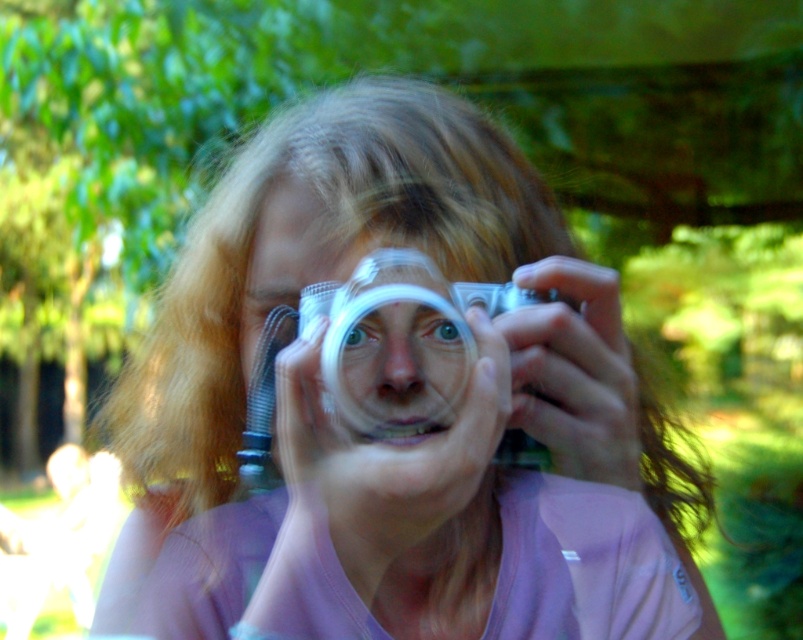
Question: Is the position of matte silver camera at center more distant than that of blue glossy eye at center?

Choices:
 (A) no
 (B) yes

Answer: (A)

Question: Is matte silver camera at center to the left of matte plastic face at center from the viewer's perspective?

Choices:
 (A) yes
 (B) no

Answer: (A)

Question: Where is matte plastic face at center located in relation to green matte eye at center in the image?

Choices:
 (A) right
 (B) left

Answer: (A)

Question: Which of these objects is positioned farthest from the matte silver camera at center?

Choices:
 (A) blue glossy eye at center
 (B) green matte eye at center

Answer: (B)

Question: Among these objects, which one is nearest to the camera?

Choices:
 (A) green matte eye at center
 (B) matte plastic face at center
 (C) blue glossy eye at center
 (D) matte silver camera at center

Answer: (D)

Question: Among these objects, which one is farthest from the camera?

Choices:
 (A) green matte eye at center
 (B) blue glossy eye at center
 (C) matte silver camera at center
 (D) matte plastic face at center

Answer: (B)